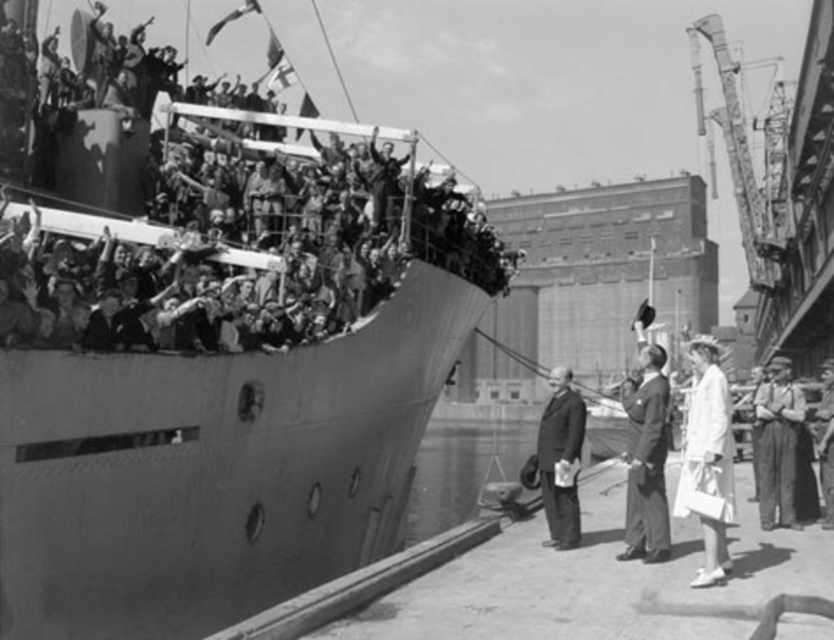
Question: From the image, what is the correct spatial relationship of smooth suit at center in relation to smooth black suit at center?

Choices:
 (A) right
 (B) left

Answer: (A)

Question: Which object appears closest to the camera in this image?

Choices:
 (A) smooth gray ship at upper left
 (B) white fabric dress at lower right

Answer: (A)

Question: Which of the following is the closest to the observer?

Choices:
 (A) (575, 435)
 (B) (701, 337)
 (C) (249, 164)

Answer: (A)

Question: Which object is the closest to the white fabric dress at lower right?

Choices:
 (A) smooth gray ship at upper left
 (B) smooth black suit at center

Answer: (B)

Question: Is white fabric dress at lower right smaller than denim pants at lower right?

Choices:
 (A) no
 (B) yes

Answer: (A)

Question: Is white fabric dress at lower right smaller than smooth suit at center?

Choices:
 (A) yes
 (B) no

Answer: (B)